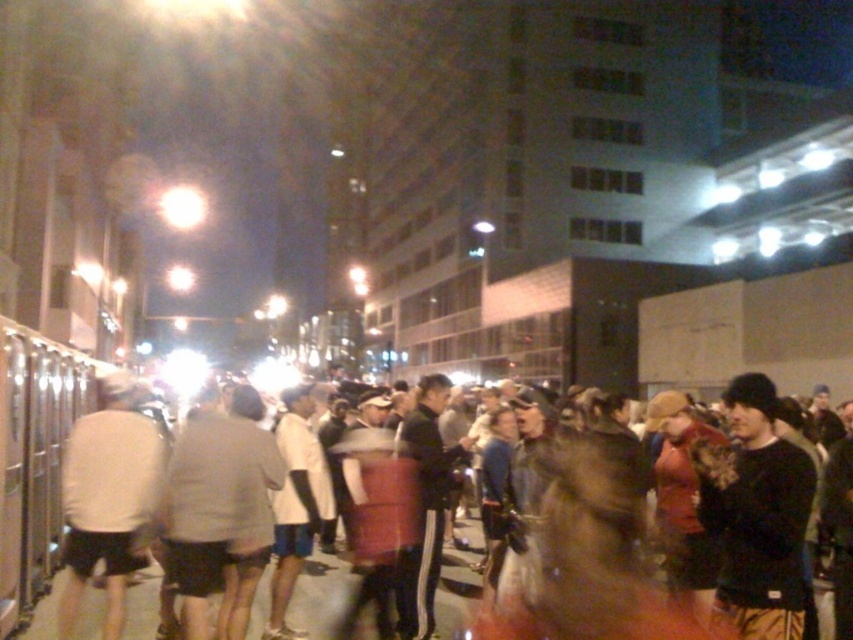
This screenshot has height=640, width=853. Describe the element at coordinates (108, 496) in the screenshot. I see `white matte shirt at center` at that location.

Is white matte shirt at center smaller than dark gray sweatshirt at center?

Yes.

Where is `white matte shirt at center`? The image size is (853, 640). white matte shirt at center is located at coordinates (108, 496).